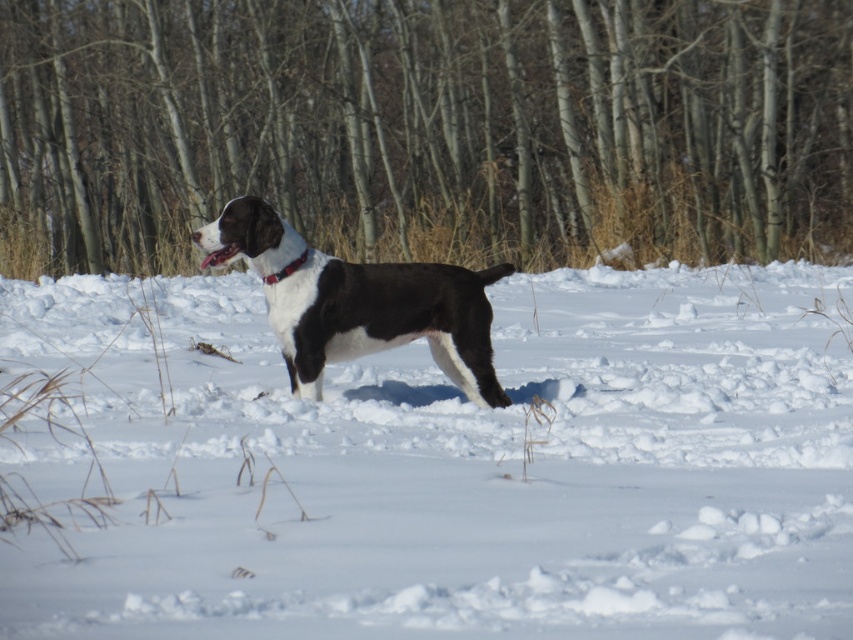
Question: Which point is farther to the camera?

Choices:
 (A) red leather collar at center
 (B) white fluffy snow at center
 (C) black matte dog at center

Answer: (A)

Question: Which object is farther from the camera taking this photo?

Choices:
 (A) white fluffy snow at center
 (B) red leather collar at center

Answer: (B)

Question: Does white fluffy snow at center have a larger size compared to black matte dog at center?

Choices:
 (A) yes
 (B) no

Answer: (A)

Question: Is black matte dog at center in front of red leather collar at center?

Choices:
 (A) no
 (B) yes

Answer: (B)

Question: Does white fluffy snow at center have a greater width compared to brown bark tree at center?

Choices:
 (A) no
 (B) yes

Answer: (A)

Question: Which of these objects is positioned closest to the white fluffy snow at center?

Choices:
 (A) black matte dog at center
 (B) red leather collar at center

Answer: (A)